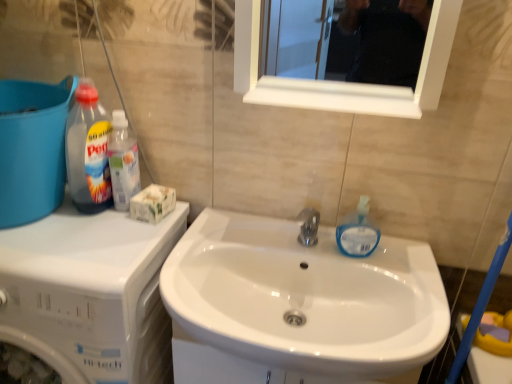
Locate an element on the screen. This screenshot has height=384, width=512. free space in front of translucent plastic bottle at upper left, the second cleaning product positioned from the right is located at coordinates (102, 239).